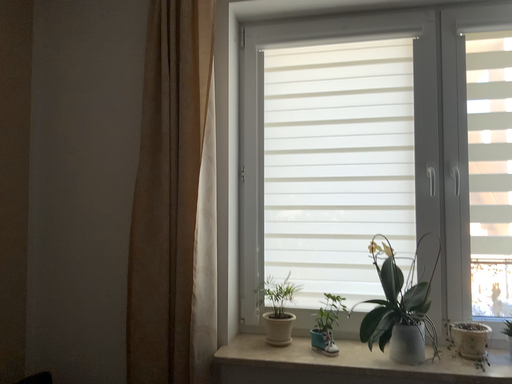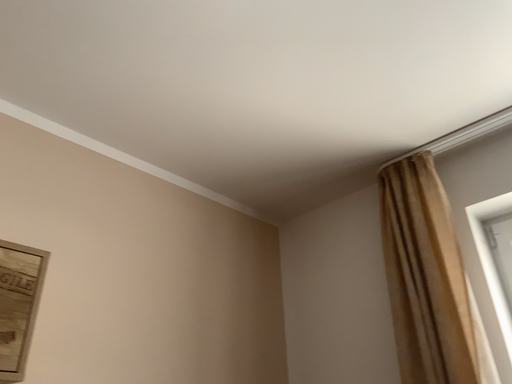
Question: How did the camera likely rotate when shooting the video?

Choices:
 (A) rotated right
 (B) rotated left

Answer: (B)